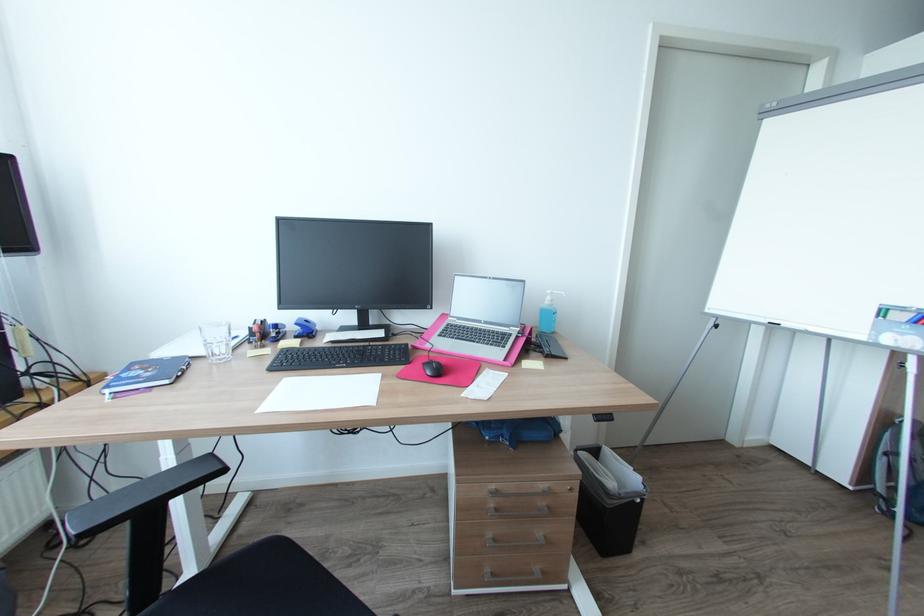
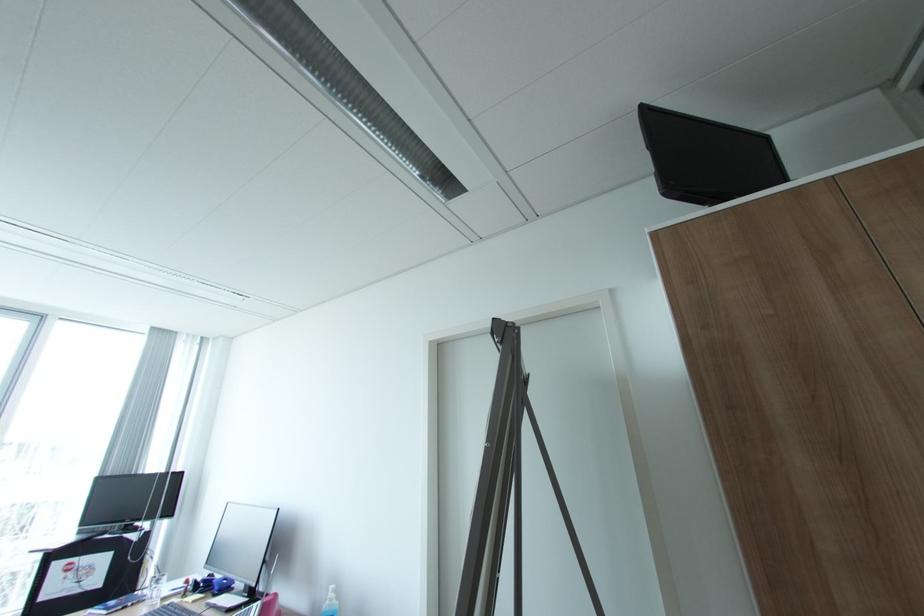
In the second image, find the point that corresponds to the point at 556,300 in the first image.

(336, 599)